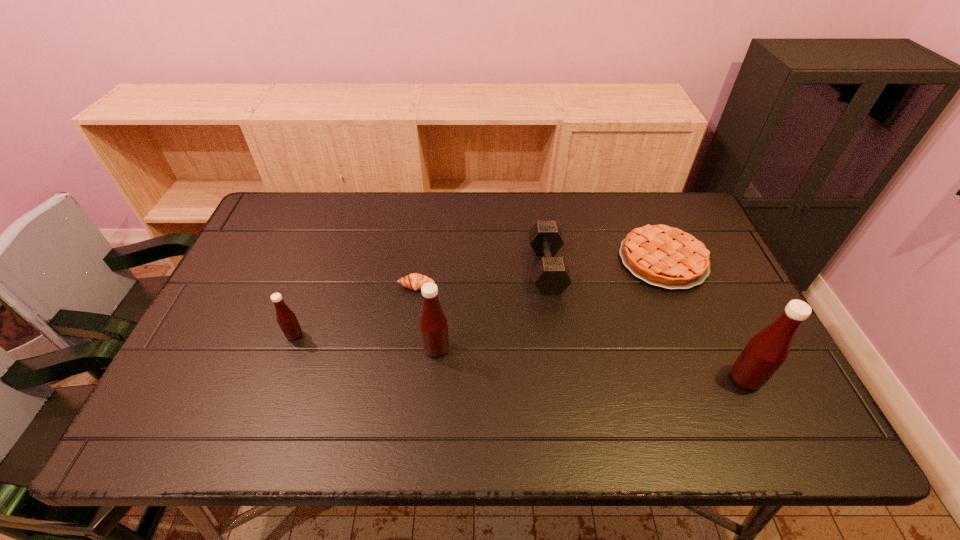
Locate an element on the screen. blank space that satisfies the following two spatial constraints: 1. on the front-facing side of the second tallest Tabasco sauce; 2. on the left side of the pastry is located at coordinates (408, 349).